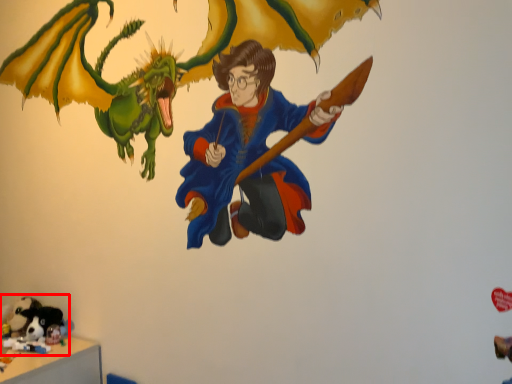
Question: Considering the relative positions of toy (annotated by the red box) and animal in the image provided, where is toy (annotated by the red box) located with respect to the staircase?

Choices:
 (A) left
 (B) right

Answer: (B)